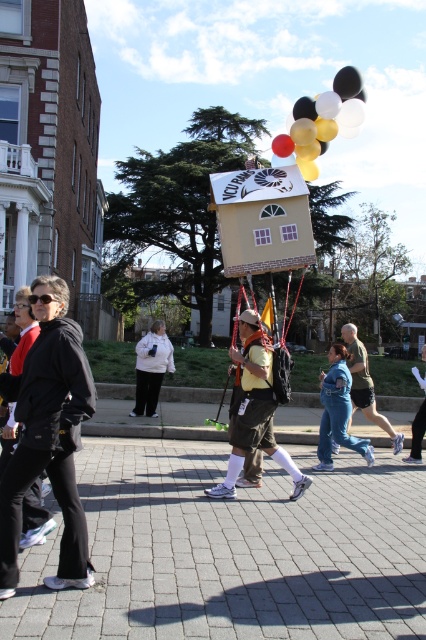
Question: Does brick pavement at center have a smaller size compared to matte khaki shorts at center?

Choices:
 (A) no
 (B) yes

Answer: (B)

Question: Does black matte jacket at left lie behind matte khaki shorts at center?

Choices:
 (A) yes
 (B) no

Answer: (B)

Question: Considering the relative positions of yellow fabric house at center and matte khaki shorts at center in the image provided, where is yellow fabric house at center located with respect to matte khaki shorts at center?

Choices:
 (A) right
 (B) left

Answer: (B)

Question: Which point is closer to the camera taking this photo?

Choices:
 (A) (161, 369)
 (B) (189, 541)
 (C) (327, 131)

Answer: (B)

Question: Among these points, which one is farthest from the camera?

Choices:
 (A) (259, 413)
 (B) (339, 413)
 (C) (175, 541)
 (D) (140, 360)

Answer: (D)

Question: Which point is closer to the camera?

Choices:
 (A) white matte jacket at center
 (B) matte black balloons at upper center
 (C) matte khaki shorts at center
 (D) black matte jacket at left

Answer: (D)